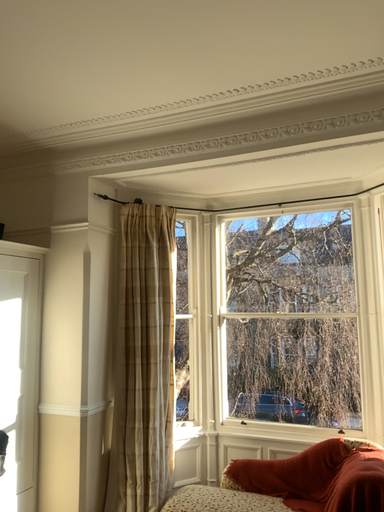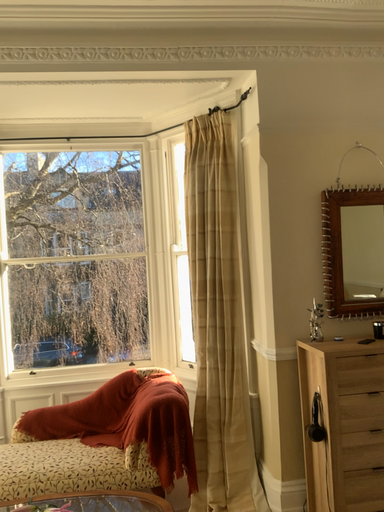
Question: How did the camera likely rotate when shooting the video?

Choices:
 (A) rotated left
 (B) rotated right

Answer: (B)